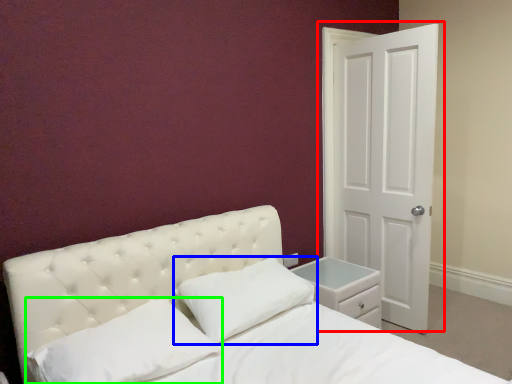
Question: Which object is positioned closest to door (highlighted by a red box)? Select from pillow (highlighted by a blue box) and pillow (highlighted by a green box).

Choices:
 (A) pillow
 (B) pillow

Answer: (A)